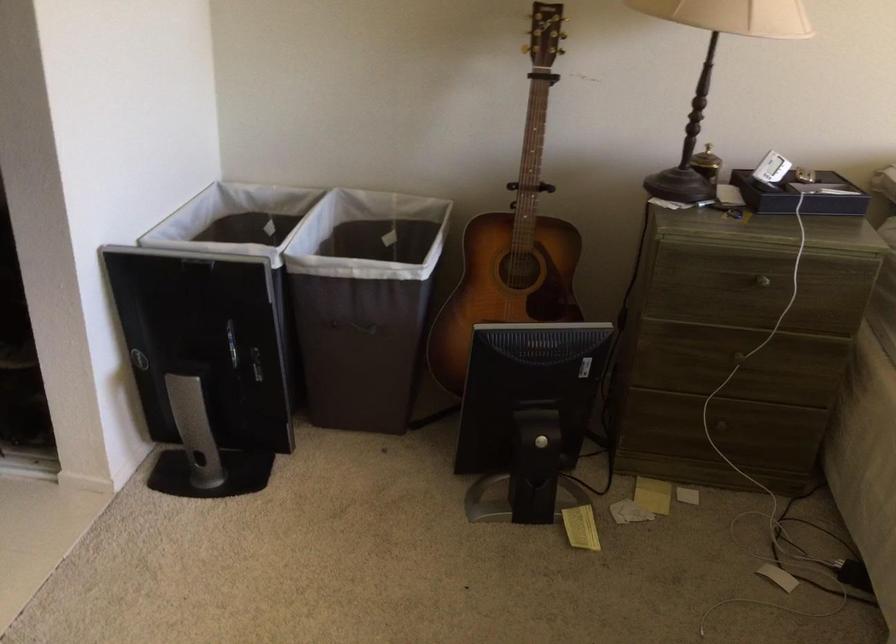
Image resolution: width=896 pixels, height=644 pixels. Find the location of `black box`. black box is located at coordinates (800, 194).